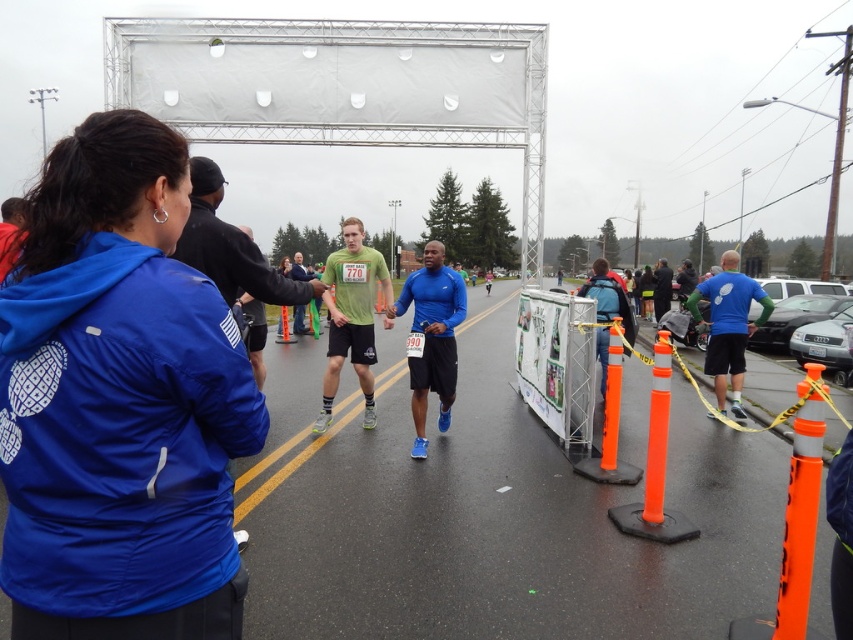
You are a runner in a marathon and you see two points marked as point (170,394) and point (426,353). Which point should you aim for first if you want to follow the correct path?

You should aim for point (170,394) first because it is in front of point (426,353) along the path.

You are a runner in the marathon and you see the blue fabric jacket at upper left and the blue matte running shoe at center. Which object is positioned further to the east?

The blue fabric jacket at upper left is positioned further to the east because it is to the left of the blue matte running shoe at center, and in the image, left corresponds to east.